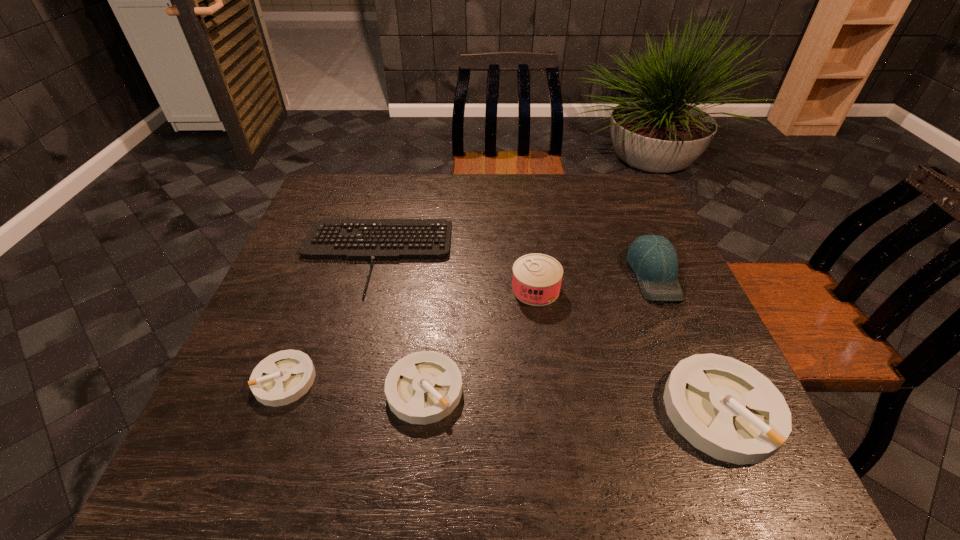
The width and height of the screenshot is (960, 540). I want to click on object that is at the near right corner, so click(725, 408).

I want to click on vacant region at the far edge of the desktop, so click(x=505, y=179).

The height and width of the screenshot is (540, 960). In order to click on free space at the left edge of the desktop in this screenshot , I will do `click(233, 372)`.

In the image, there is a desktop. Where is `blank space at the far left corner`? The width and height of the screenshot is (960, 540). blank space at the far left corner is located at coordinates (346, 189).

In the image, there is a desktop. Where is `vacant area at the far right corner`? The height and width of the screenshot is (540, 960). vacant area at the far right corner is located at coordinates (x=591, y=195).

Identify the location of free space between the third shortest object and the fourth shortest object. (573, 400).

Image resolution: width=960 pixels, height=540 pixels. I want to click on unoccupied position between the tallest ashtray and the second tallest ashtray, so click(573, 400).

This screenshot has height=540, width=960. What are the coordinates of `free space that is in between the fourth object from left to right and the shortest object` in the screenshot? It's located at (455, 273).

Identify the location of vacant region between the tallest ashtray and the third object from right to left. (628, 350).

Where is `vacant space that is in between the fifth tallest object and the shortest object`? The image size is (960, 540). vacant space that is in between the fifth tallest object and the shortest object is located at coordinates pos(330,318).